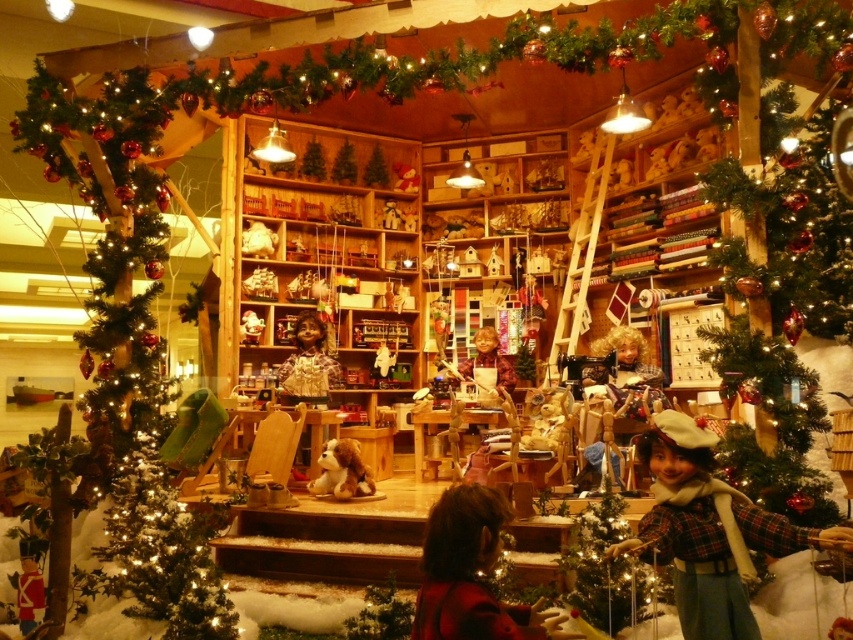
Can you confirm if brown woolen sweater at lower center is taller than smooth wooden doll at center?

No, brown woolen sweater at lower center is not taller than smooth wooden doll at center.

Which is behind, point (503, 637) or point (486, 365)?

The point (486, 365) is more distant.

Where is `brown woolen sweater at lower center`? brown woolen sweater at lower center is located at coordinates (471, 573).

What do you see at coordinates (709, 531) in the screenshot? I see `matte plaid coat at center` at bounding box center [709, 531].

Does matte plaid coat at center have a lesser width compared to fluffy brown plush at center?

No, matte plaid coat at center is not thinner than fluffy brown plush at center.

Is point (744, 608) positioned behind point (358, 451)?

No, it is in front of (358, 451).

Identify the location of matte plaid coat at center. The width and height of the screenshot is (853, 640). (709, 531).

Does fluffy brown plush at center appear under smooth wooden doll at center?

Correct, fluffy brown plush at center is located below smooth wooden doll at center.

Consider the image. Is fluffy brown plush at center positioned behind smooth wooden doll at center?

No, it is not.

Is point (316, 481) closer to viewer compared to point (474, 344)?

Yes.

This screenshot has width=853, height=640. Identify the location of fluffy brown plush at center. pos(341,472).